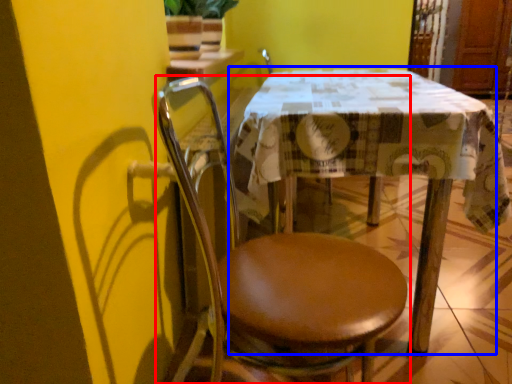
Question: Which of the following is the closest to the observer, chair (highlighted by a red box) or table (highlighted by a blue box)?

Choices:
 (A) chair
 (B) table

Answer: (A)